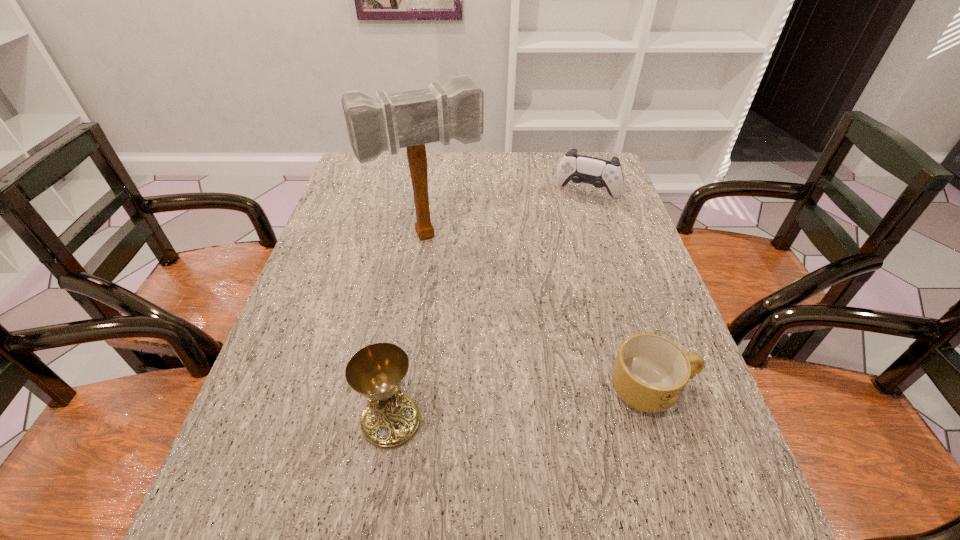
Where is `free location located 0.380m at the head of the mallet`? free location located 0.380m at the head of the mallet is located at coordinates (501, 366).

At what (x,y) coordinates should I click in order to perform the action: click on free space located 0.100m at the head of the mallet. Please return your answer as a coordinate pair (x, y). Looking at the image, I should click on (458, 280).

Where is `vacant point located at the head of the mallet`? vacant point located at the head of the mallet is located at coordinates (492, 348).

Identify the location of object present at the far edge. (600, 173).

This screenshot has height=540, width=960. I want to click on object at the near edge, so click(391, 419).

Find the location of a particular element. object located in the left edge section of the desktop is located at coordinates (411, 119).

The height and width of the screenshot is (540, 960). In order to click on mug at the right edge in this screenshot , I will do `click(650, 372)`.

Locate an element on the screen. The width and height of the screenshot is (960, 540). control that is at the right edge is located at coordinates (600, 173).

You are a GUI agent. You are given a task and a screenshot of the screen. Output one action in this format:
    pyautogui.click(x=<x>, y=<y>)
    Task: Click on the object that is positioned at the far right corner
    The image size is (960, 540).
    Given the screenshot: What is the action you would take?
    pyautogui.click(x=600, y=173)

In the image, there is a desktop. In order to click on vacant area at the far edge in this screenshot , I will do `click(429, 159)`.